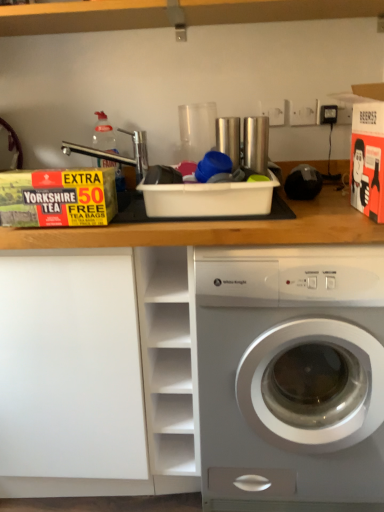
The image size is (384, 512). Describe the element at coordinates (169, 364) in the screenshot. I see `white matte cabinet at center` at that location.

Where is `white glossy washing machine at center`? This screenshot has width=384, height=512. white glossy washing machine at center is located at coordinates (291, 376).

Identify the location of white matte cabinet at center. The height and width of the screenshot is (512, 384). (169, 364).

From a real-world perspective, which object rests below the other?

From a 3D spatial view, white matte box at left is below.

Which is closer to the camera, (228, 327) or (2, 378)?

Point (228, 327) is positioned closer to the camera compared to point (2, 378).

Based on the photo, would you say white glossy washing machine at center is outside white matte box at left?

Yes, white glossy washing machine at center is outside of white matte box at left.

Where is `washing machine above the white matte box at left (from the image's perspective)`? The width and height of the screenshot is (384, 512). washing machine above the white matte box at left (from the image's perspective) is located at coordinates 291,376.

Is clear plastic bottle at upper left positioned with its back to white matte cabinet at center?

No, white matte cabinet at center is not at the back of clear plastic bottle at upper left.

From a real-world perspective, which is physically above, clear plastic bottle at upper left or white matte cabinet at center?

clear plastic bottle at upper left is physically above.

How far apart are clear plastic bottle at upper left and white matte cabinet at center?

25.65 inches.

Considering the relative positions of clear plastic bottle at upper left and white matte cabinet at center in the image provided, is clear plastic bottle at upper left in front of white matte cabinet at center?

No, clear plastic bottle at upper left is further to the viewer.

Is clear plastic bottle at upper left in contact with white glossy washing machine at center?

There is a gap between clear plastic bottle at upper left and white glossy washing machine at center.

Could you tell me if clear plastic bottle at upper left is turned towards white glossy washing machine at center?

No.

Considering the relative sizes of clear plastic bottle at upper left and white glossy washing machine at center in the image provided, is clear plastic bottle at upper left shorter than white glossy washing machine at center?

Correct, clear plastic bottle at upper left is not as tall as white glossy washing machine at center.

Which object is thinner, clear plastic bottle at upper left or white glossy washing machine at center?

clear plastic bottle at upper left is thinner.

Is white matte box at left looking in the opposite direction of white matte cabinet at center?

No, white matte box at left is not facing away from white matte cabinet at center.

Would you say white matte box at left is to the left or to the right of white matte cabinet at center in the picture?

From the image, it's evident that white matte box at left is to the left of white matte cabinet at center.

Does white matte box at left touch white matte cabinet at center?

white matte box at left and white matte cabinet at center are clearly separated.

Can you confirm if white matte cabinet at center is positioned to the right of white glossy washing machine at center?

No, white matte cabinet at center is not to the right of white glossy washing machine at center.

Considering the relative sizes of white matte cabinet at center and white glossy washing machine at center in the image provided, is white matte cabinet at center shorter than white glossy washing machine at center?

Correct, white matte cabinet at center is not as tall as white glossy washing machine at center.

Between point (188, 313) and point (224, 267), which one is positioned behind?

The point (188, 313) is more distant.

Which is correct: clear plastic bottle at upper left is inside white matte box at left, or outside of it?

The correct answer is: outside.

Does point (115, 168) come closer to viewer compared to point (68, 429)?

That is True.

Is clear plastic bottle at upper left in front of or behind white matte box at left in the image?

Clearly, clear plastic bottle at upper left is behind white matte box at left.

From a real-world perspective, is clear plastic bottle at upper left positioned under white matte box at left based on gravity?

No, from a real-world perspective, clear plastic bottle at upper left is not below white matte box at left.

Are white glossy washing machine at center and white matte cabinet at center beside each other?

white glossy washing machine at center and white matte cabinet at center are not in contact.

Which object is more forward, white glossy washing machine at center or white matte cabinet at center?

white glossy washing machine at center is more forward.

Considering the sizes of white glossy washing machine at center and white matte cabinet at center in the image, is white glossy washing machine at center taller or shorter than white matte cabinet at center?

Clearly, white glossy washing machine at center is taller compared to white matte cabinet at center.

The image size is (384, 512). I want to click on shelf beneath the white glossy washing machine at center (from a real-world perspective), so click(x=71, y=377).

The image size is (384, 512). What are the coordinates of `cabinet located on the right of clear plastic bottle at upper left` in the screenshot? It's located at (169, 364).

Based on their spatial positions, is white glossy washing machine at center or white matte cabinet at center closer to white matte box at left?

white matte cabinet at center is positioned closer to the anchor white matte box at left.

Based on their spatial positions, is white glossy washing machine at center or white matte box at left closer to white matte cabinet at center?

Among the two, white matte box at left is located nearer to white matte cabinet at center.

Estimate the real-world distances between objects in this image. Which object is further from clear plastic bottle at upper left, white glossy washing machine at center or white matte cabinet at center?

white glossy washing machine at center lies further to clear plastic bottle at upper left than the other object.

From the image, which object appears to be nearer to white matte cabinet at center, white glossy washing machine at center or clear plastic bottle at upper left?

white glossy washing machine at center is closer to white matte cabinet at center.

Looking at the image, which one is located closer to white matte cabinet at center, clear plastic bottle at upper left or white matte box at left?

white matte box at left is closer to white matte cabinet at center.

Looking at the image, which one is located closer to white matte box at left, clear plastic bottle at upper left or white glossy washing machine at center?

white glossy washing machine at center is positioned closer to the anchor white matte box at left.

From the image, which object appears to be farther from clear plastic bottle at upper left, white matte box at left or white matte cabinet at center?

Among the two, white matte box at left is located further to clear plastic bottle at upper left.

Considering their positions, is white matte cabinet at center positioned further to clear plastic bottle at upper left than white matte box at left?

The object further to clear plastic bottle at upper left is white matte box at left.

Find the location of a particular element. cabinet located between white matte box at left and white glossy washing machine at center in the left-right direction is located at coordinates (169, 364).

The width and height of the screenshot is (384, 512). I want to click on cabinet between clear plastic bottle at upper left and white matte box at left vertically, so click(x=169, y=364).

The image size is (384, 512). Identify the location of bottle situated between white matte box at left and white glossy washing machine at center from left to right. (104, 135).

Image resolution: width=384 pixels, height=512 pixels. I want to click on cabinet between clear plastic bottle at upper left and white glossy washing machine at center in the vertical direction, so click(169, 364).